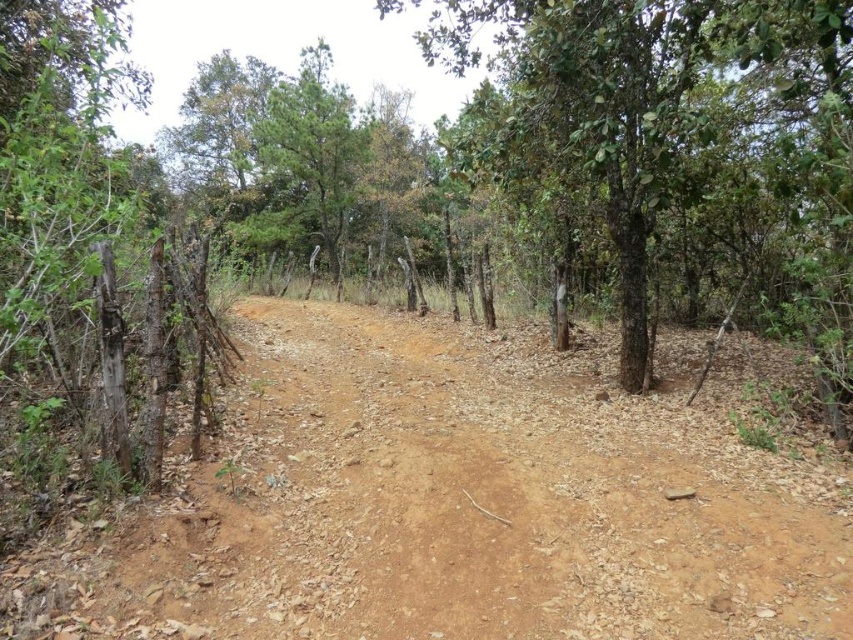
Question: Can you confirm if brown dirt track at center is smaller than green rough bark tree at center?

Choices:
 (A) no
 (B) yes

Answer: (A)

Question: Which point is farther to the camera?

Choices:
 (A) brown dirt track at center
 (B) green rough bark tree at center

Answer: (B)

Question: Can you confirm if brown dirt track at center is smaller than green rough bark tree at center?

Choices:
 (A) no
 (B) yes

Answer: (A)

Question: Among these objects, which one is nearest to the camera?

Choices:
 (A) green rough bark tree at center
 (B) brown dirt track at center

Answer: (B)

Question: Is brown dirt track at center further to the viewer compared to green rough bark tree at center?

Choices:
 (A) no
 (B) yes

Answer: (A)